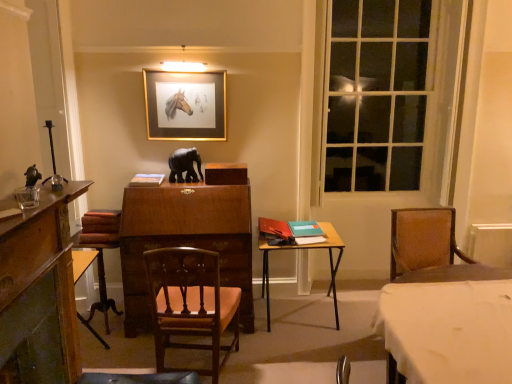
The height and width of the screenshot is (384, 512). I want to click on vacant space underneath wooden table at center, the first table positioned from the left (from a real-world perspective), so click(x=301, y=322).